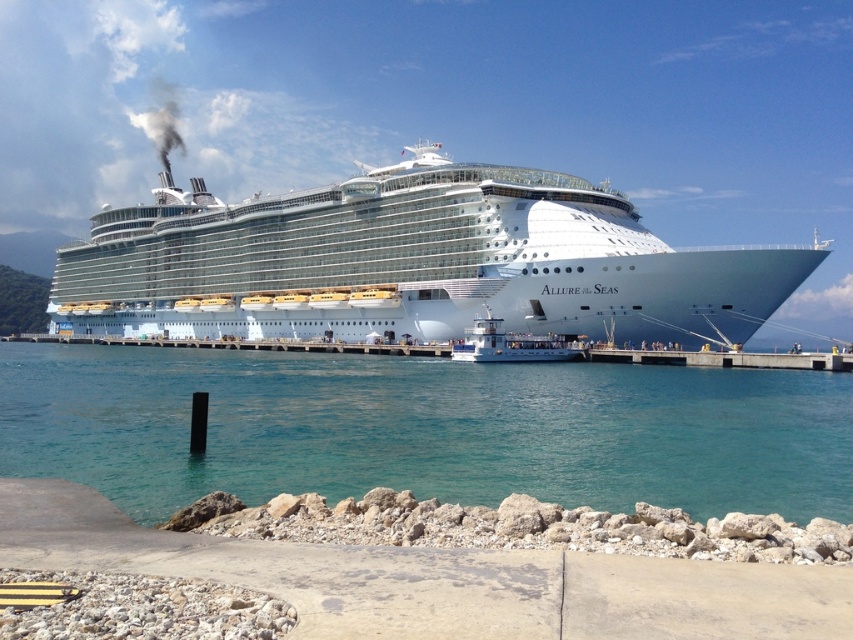
You are standing on the cruise ship Allure of the Seas and looking out towards the pier. There are two points marked on the ship deck at coordinates point (604, 348) and point (488, 314). Which point is closer to the front of the ship?

Point (604, 348) is in front of point (488, 314), so it is closer to the front of the ship.

You are standing on the pier looking at the Allure of the Seas. There is a point marked at coordinates [410,262]. What does this point indicate?

The point marked at coordinates [410,262] indicates the location of the white glossy cruise ship at center.

You are standing on the gray concrete dock at lower right and want to throw a pebble into the clear blue water at center. Based on the scene, will the pebble land in the water?

The clear blue water at center is closer to the viewer than the gray concrete dock at lower right, so yes, the pebble will land in the clear blue water at center because it is nearer to you than the dock.